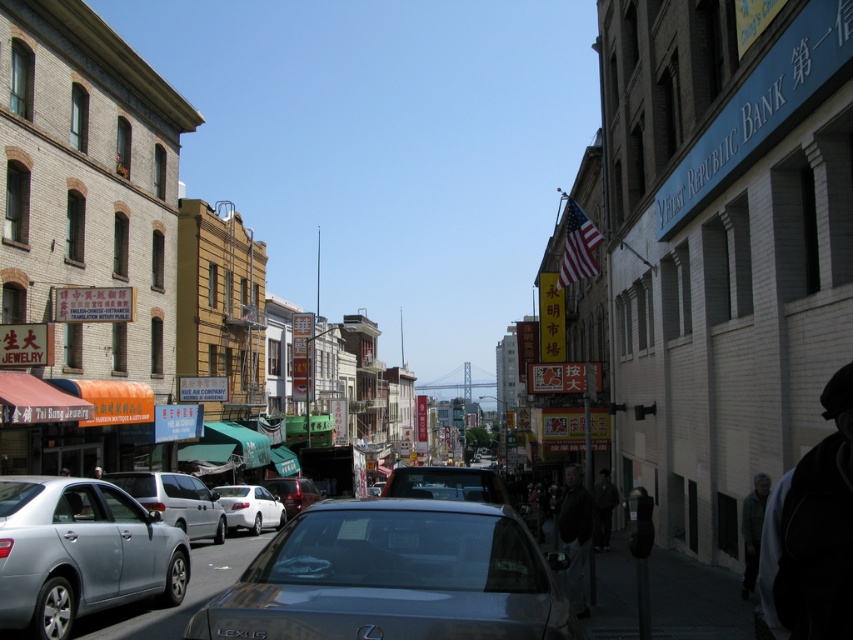
Question: Considering the real-world distances, which object is farthest from the silver metallic sedan at lower left?

Choices:
 (A) gray wool coat at lower right
 (B) silver metallic van at center
 (C) white matte sedan at center

Answer: (C)

Question: Which point appears farthest from the camera in this image?

Choices:
 (A) (126, 484)
 (B) (242, 627)
 (C) (149, 577)
 (D) (283, 504)

Answer: (D)

Question: Does metallic gray sedan at center appear on the right side of silver metallic van at center?

Choices:
 (A) yes
 (B) no

Answer: (A)

Question: Estimate the real-world distances between objects in this image. Which object is farther from the metallic gray sedan at center?

Choices:
 (A) silver metallic van at center
 (B) dark gray jacket at lower right

Answer: (A)

Question: Considering the relative positions of silver metallic sedan at lower left and silver metallic van at center in the image provided, where is silver metallic sedan at lower left located with respect to silver metallic van at center?

Choices:
 (A) left
 (B) right

Answer: (B)

Question: Is dark gray jacket at lower right to the left of shiny red sedan at center from the viewer's perspective?

Choices:
 (A) yes
 (B) no

Answer: (B)